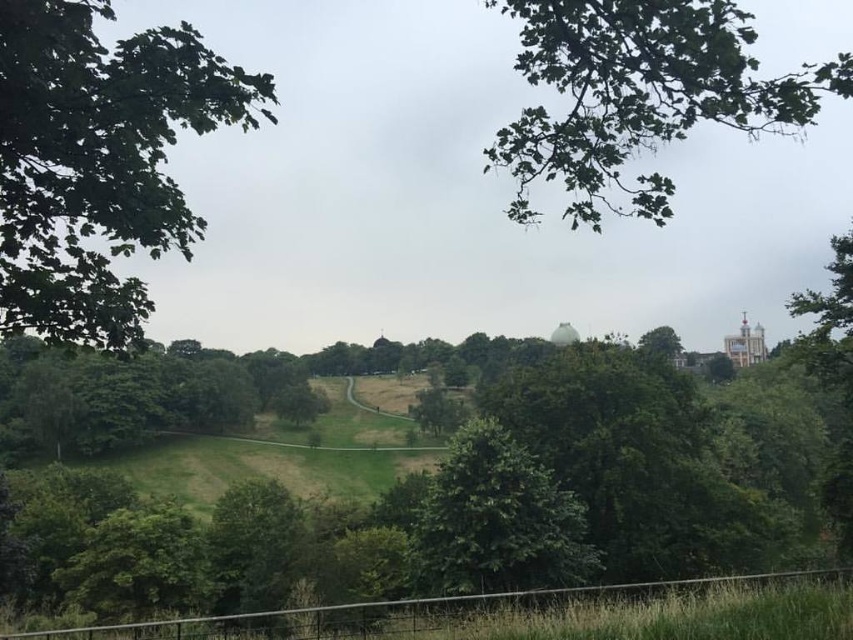
Question: Does green leafy tree at left have a larger size compared to green leafy tree at upper right?

Choices:
 (A) no
 (B) yes

Answer: (A)

Question: Among these points, which one is farthest from the camera?

Choices:
 (A) pos(170,77)
 (B) pos(631,122)

Answer: (B)

Question: Does green leafy tree at left appear on the right side of green leafy tree at upper right?

Choices:
 (A) no
 (B) yes

Answer: (A)

Question: Which object is the farthest from the green leafy tree at left?

Choices:
 (A) green leafy tree at center
 (B) green leafy tree at upper right

Answer: (B)

Question: Which point is farther to the camera?

Choices:
 (A) green leafy tree at upper right
 (B) green leafy tree at center
 (C) green leafy tree at left

Answer: (B)

Question: Does green leafy tree at upper right appear on the right side of green leafy tree at center?

Choices:
 (A) no
 (B) yes

Answer: (B)